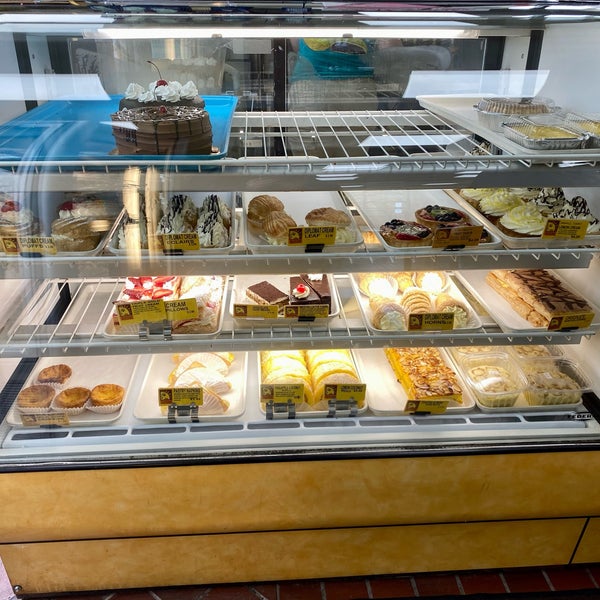
Find the location of `kickboard divider`. kickboard divider is located at coordinates (578, 542).